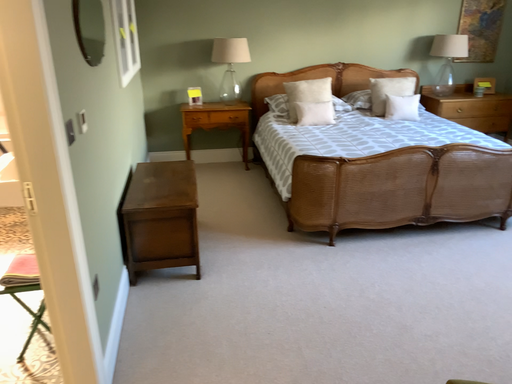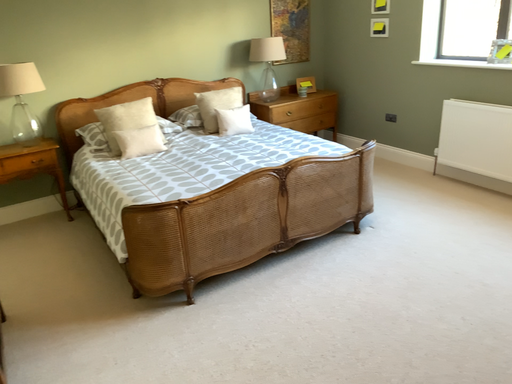
Question: How did the camera likely rotate when shooting the video?

Choices:
 (A) rotated right
 (B) rotated left

Answer: (A)